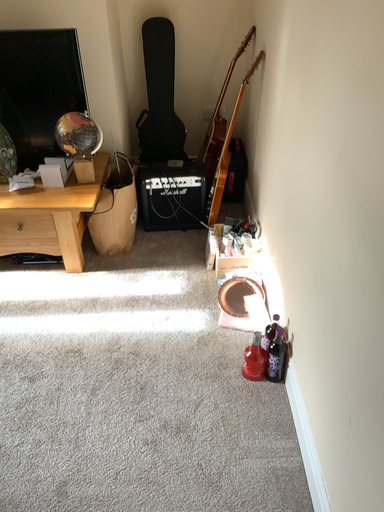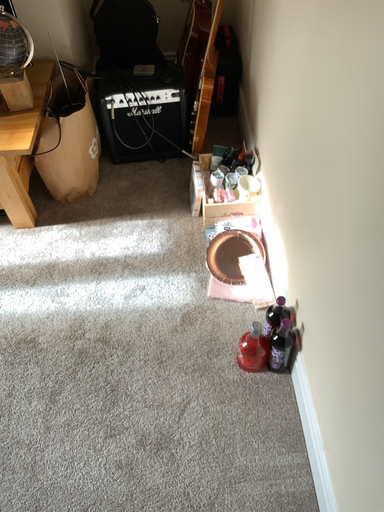
Question: How did the camera likely rotate when shooting the video?

Choices:
 (A) rotated downward
 (B) rotated upward

Answer: (A)